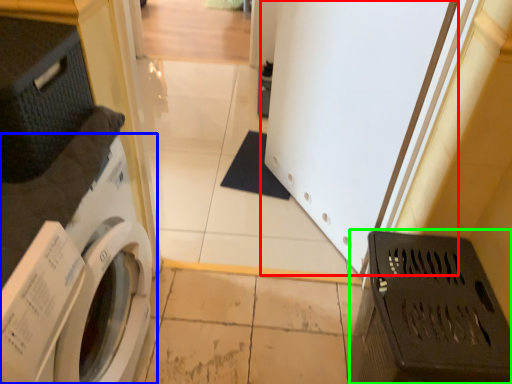
Question: Which object is the closest to the screen door (highlighted by a red box)? Choose among these: washing machine (highlighted by a blue box) or laundry basket (highlighted by a green box).

Choices:
 (A) washing machine
 (B) laundry basket

Answer: (B)